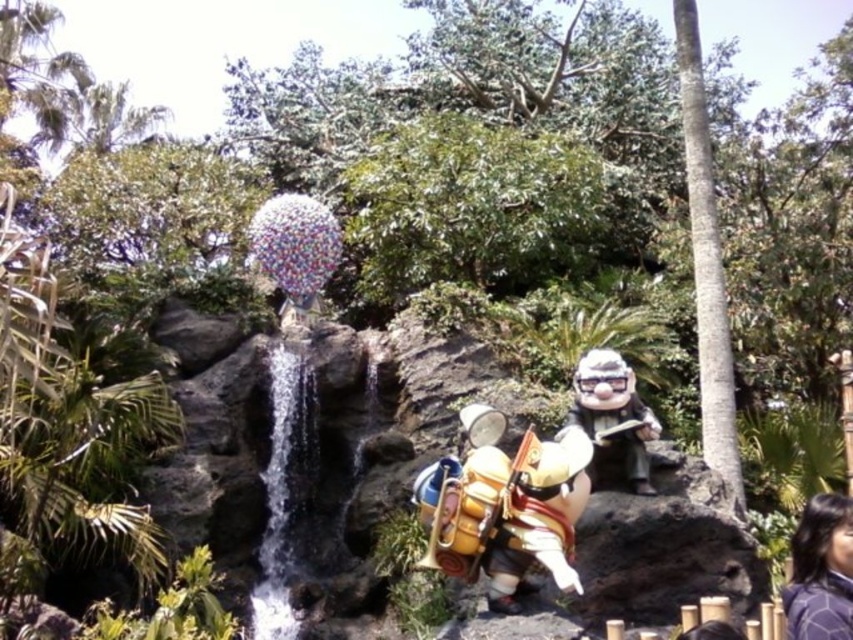
You are standing in the outdoor scene described. There is a point marked at coordinates (821,572). What object is located at this point?

The dark blue textured shirt at lower right is located at point (821,572).

You are a visitor at this attraction and want to take a photo with both the matte brown statue at center and the gold metallic armor at center in the same frame. Based on their sizes, which object should you move closer to ensure both fit in the photo?

The matte brown statue at center is much taller than the gold metallic armor at center. To include both in the photo, you should move closer to the matte brown statue at center so that its size relative to the gold metallic armor at center balances within the frame.